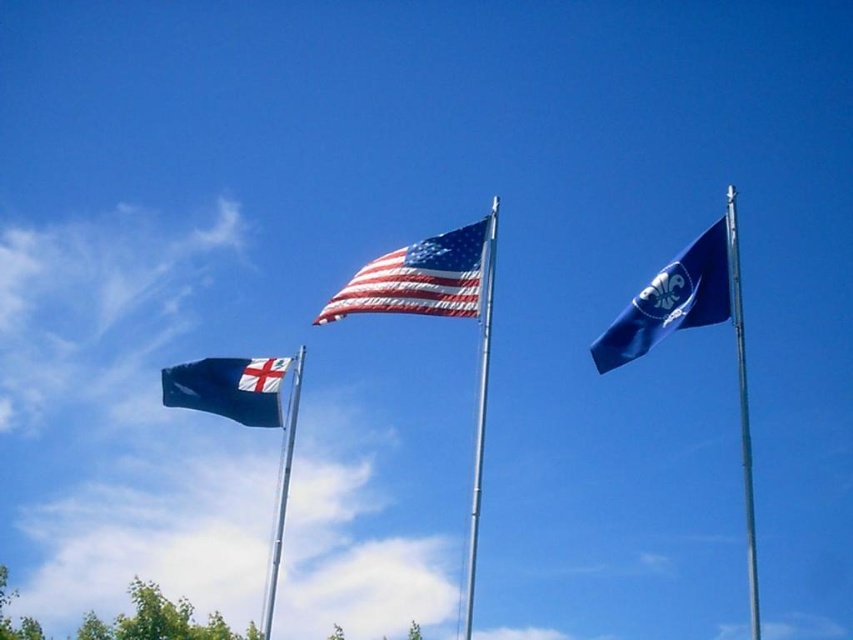
Does metallic silver flag pole at right have a greater width compared to silver metallic flag pole at center?

Yes.

Is metallic silver flag pole at right thinner than silver metallic flag pole at center?

No.

Where is `metallic silver flag pole at right`? Image resolution: width=853 pixels, height=640 pixels. metallic silver flag pole at right is located at coordinates (741, 403).

Is blue fabric flag at upper right to the left of blue metallic flag pole at center from the viewer's perspective?

In fact, blue fabric flag at upper right is to the right of blue metallic flag pole at center.

Can you confirm if blue fabric flag at upper right is wider than blue metallic flag pole at center?

Yes.

Find the location of a particular element. The height and width of the screenshot is (640, 853). blue fabric flag at upper right is located at coordinates (671, 300).

This screenshot has height=640, width=853. Identify the location of blue fabric flag at upper right. (671, 300).

Can you confirm if metallic silver flag pole at right is bigger than blue metallic flag pole at center?

Indeed, metallic silver flag pole at right has a larger size compared to blue metallic flag pole at center.

This screenshot has width=853, height=640. In order to click on metallic silver flag pole at right in this screenshot , I will do `click(741, 403)`.